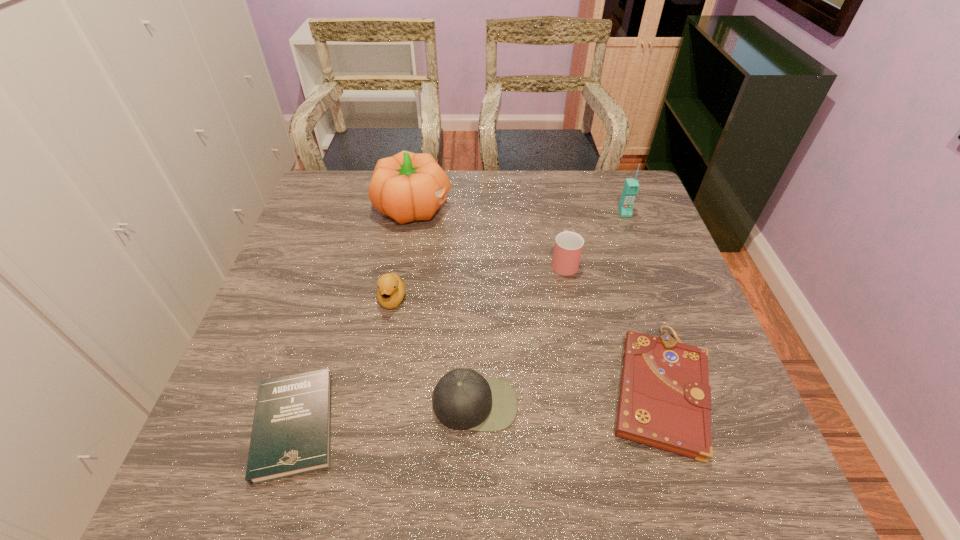
Identify which object is the second closest to the cellular telephone. Please provide its 2D coordinates. Your answer should be formatted as a tuple, i.e. [(x, y)], where the tuple contains the x and y coordinates of a point satisfying the conditions above.

[(665, 399)]

I want to click on the sixth closest object to the cup, so click(291, 435).

Find the location of a particular element. Image resolution: width=960 pixels, height=540 pixels. blank space that satisfies the following two spatial constraints: 1. on the back side of the book; 2. on the right side of the notebook is located at coordinates (305, 389).

You are a GUI agent. You are given a task and a screenshot of the screen. Output one action in this format:
    pyautogui.click(x=<x>, y=<y>)
    Task: Click on the vacant area that satisfies the following two spatial constraints: 1. on the carved face of the pumpkin; 2. on the back side of the second shortest object
    
    Given the screenshot: What is the action you would take?
    pyautogui.click(x=383, y=389)

Identify the location of vacant point that satisfies the following two spatial constraints: 1. on the face of the fourth farthest object; 2. on the right side of the notebook. (376, 389).

The width and height of the screenshot is (960, 540). In order to click on blank area in the image that satisfies the following two spatial constraints: 1. on the carved face of the pumpkin; 2. on the side of the cup with the handle in this screenshot , I will do `click(404, 262)`.